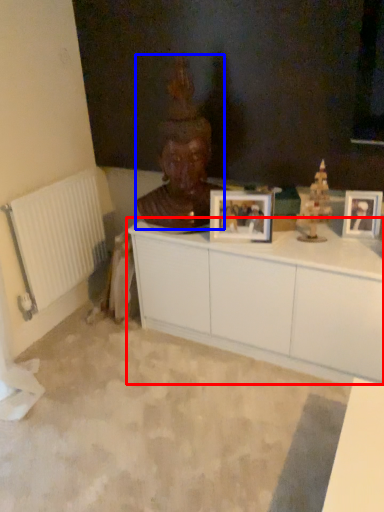
Question: Which of the following is the closest to the observer, cabinetry (highlighted by a red box) or person (highlighted by a blue box)?

Choices:
 (A) cabinetry
 (B) person

Answer: (A)